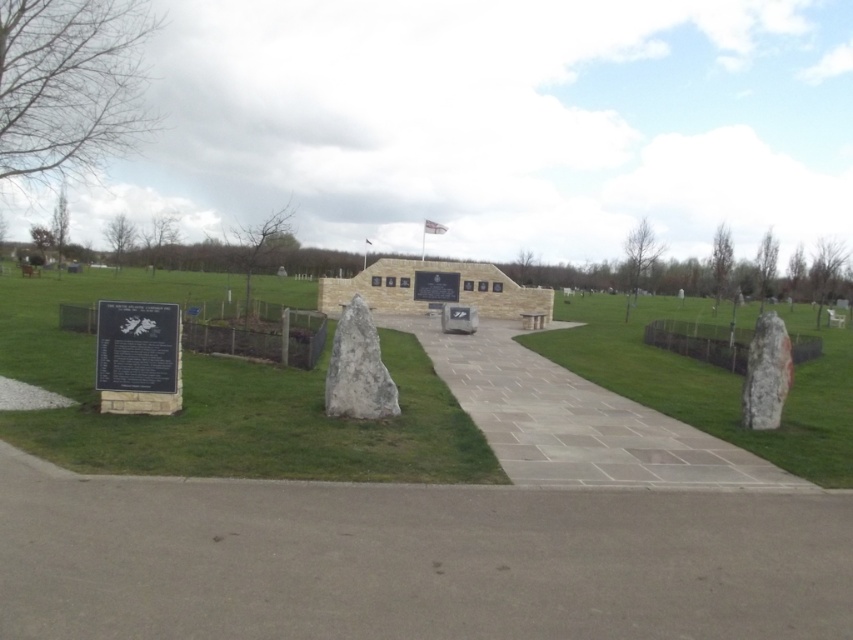
Looking at this image, is gray stone path at center bigger than white textured stone at right?

Yes.

Does point (712, 460) come in front of point (779, 323)?

Yes.

Is point (500, 410) positioned behind point (769, 388)?

That is True.

The image size is (853, 640). Identify the location of gray stone path at center. (577, 420).

Does gray concrete path at center appear over black polished stone plaque at lower left?

No.

Which is behind, point (61, 568) or point (167, 372)?

Point (167, 372)

The width and height of the screenshot is (853, 640). What do you see at coordinates (413, 561) in the screenshot?
I see `gray concrete path at center` at bounding box center [413, 561].

The image size is (853, 640). Identify the location of gray concrete path at center. (413, 561).

Can you confirm if gray stone path at center is bigger than black polished stone plaque at lower left?

Correct, gray stone path at center is larger in size than black polished stone plaque at lower left.

Locate an element on the screen. This screenshot has height=640, width=853. gray stone path at center is located at coordinates (577, 420).

Between point (712, 444) and point (175, 326), which one is positioned in front?

Point (175, 326) is in front.

Identify the location of gray stone path at center. (577, 420).